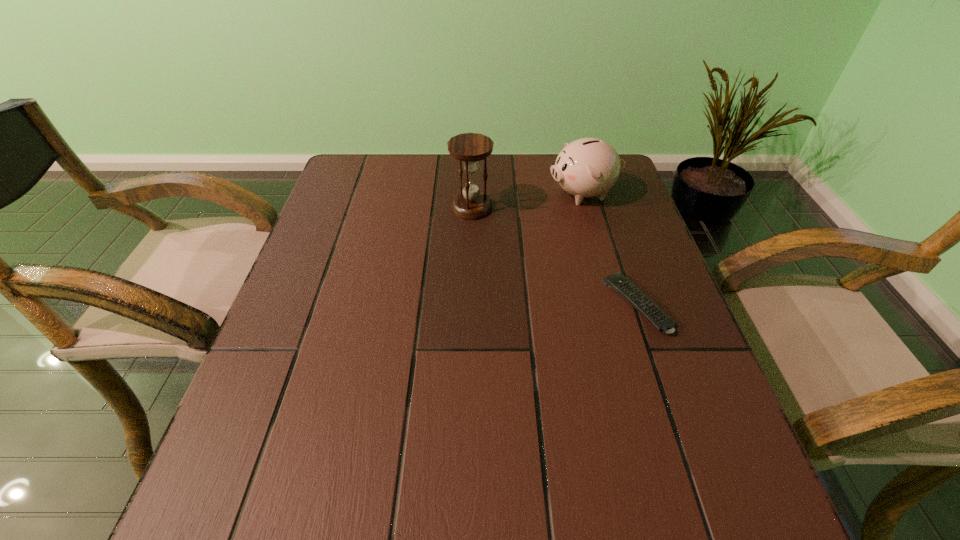
The image size is (960, 540). In order to click on piggy bank situated at the right edge in this screenshot , I will do `click(587, 167)`.

Where is `remote control positioned at the right edge`? The image size is (960, 540). remote control positioned at the right edge is located at coordinates (618, 282).

The image size is (960, 540). I want to click on object that is at the far right corner, so click(587, 167).

In the image, there is a desktop. Identify the location of vacant space at the far edge. Image resolution: width=960 pixels, height=540 pixels. (508, 171).

You are a GUI agent. You are given a task and a screenshot of the screen. Output one action in this format:
    pyautogui.click(x=<x>, y=<y>)
    Task: Click on the blank space at the left edge
    
    Given the screenshot: What is the action you would take?
    pyautogui.click(x=316, y=294)

Find the location of a particular element. The height and width of the screenshot is (540, 960). free point at the right edge is located at coordinates (664, 352).

This screenshot has height=540, width=960. I want to click on free region at the far left corner, so click(x=354, y=178).

Identify the location of free space between the shortest object and the second tallest object. (611, 249).

Find the location of a particular element. The width and height of the screenshot is (960, 540). free space between the piggy bank and the shortest object is located at coordinates (611, 249).

Identify the location of free spot between the nearest object and the tallest object. (554, 256).